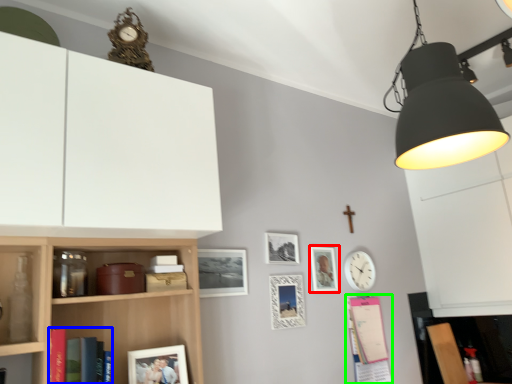
Question: Considering the real-world distances, which object is closest to picture frame (highlighted by a red box)? book (highlighted by a blue box) or book (highlighted by a green box).

Choices:
 (A) book
 (B) book

Answer: (B)